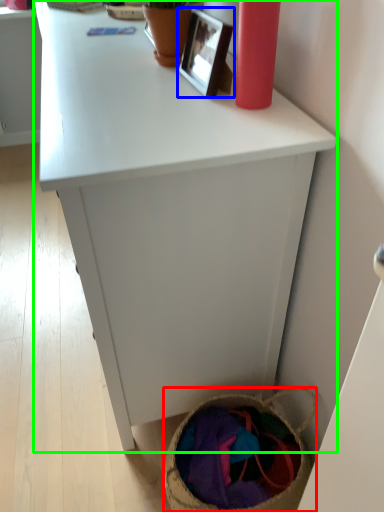
Question: Considering the real-world distances, which object is closest to basket (highlighted by a red box)? picture frame (highlighted by a blue box) or desk (highlighted by a green box).

Choices:
 (A) picture frame
 (B) desk

Answer: (B)